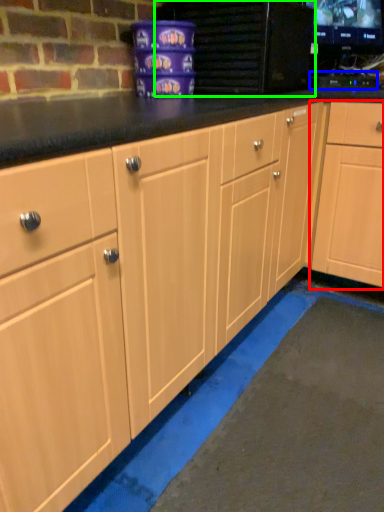
Question: Which object is the closest to the cabinetry (highlighted by a red box)? Choose among these: appliance (highlighted by a blue box) or appliance (highlighted by a green box).

Choices:
 (A) appliance
 (B) appliance

Answer: (A)